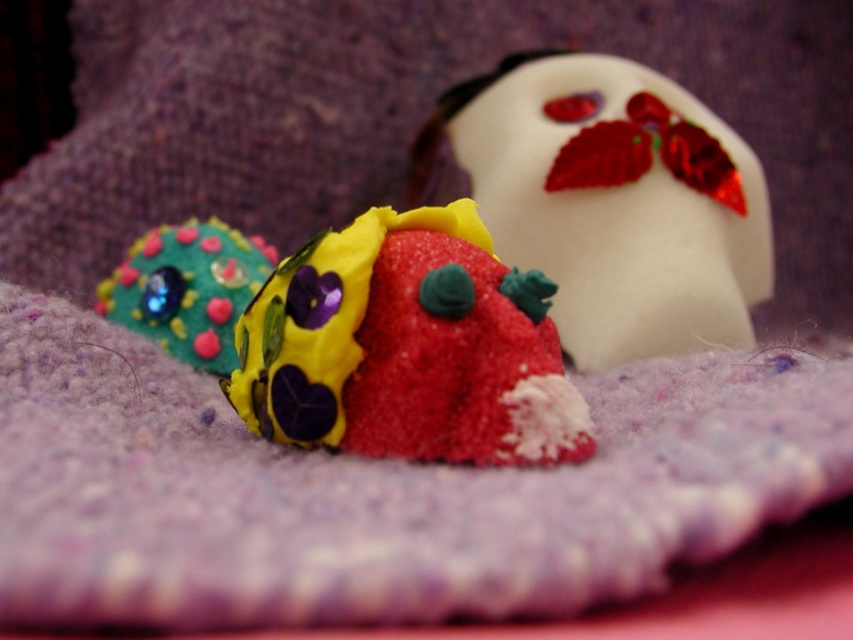
Based on the photo, you are an interior designer arranging items on a shelf. You have a white glossy ghost at upper right and a matte green fabric flower at left. Which item should you place higher on the shelf to maintain visual balance?

To maintain visual balance, you should place the white glossy ghost at upper right higher on the shelf since it has a greater height compared to the matte green fabric flower at left.

You are planning to place a small decorative item on a shelf that can only hold items smaller than the matte green fabric flower at left. Can the sandy clay strawberry at center fit on the shelf?

The sandy clay strawberry at center is smaller than the matte green fabric flower at left, so it can fit on the shelf.

You are a child trying to fit both the white glossy ghost at upper right and the sandy clay strawberry at center into a rectangular box. Which object should you place first to ensure both fit inside?

The white glossy ghost at upper right is wider than the sandy clay strawberry at center. Therefore, you should place the wider white glossy ghost at upper right first to ensure both fit in the box.